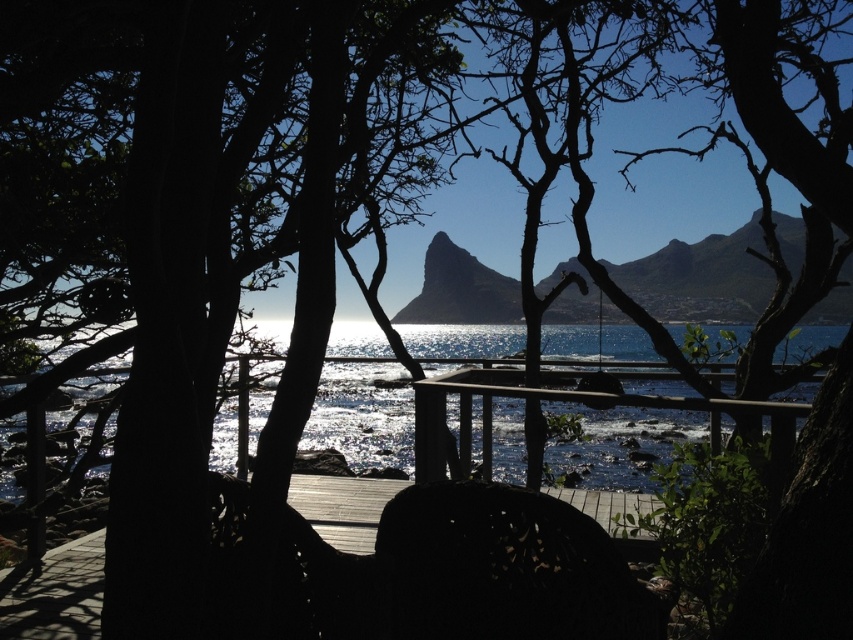
Question: Which point is closer to the camera taking this photo?

Choices:
 (A) (500, 496)
 (B) (646, 556)
 (C) (341, 420)

Answer: (A)

Question: Considering the real-world distances, which object is closest to the black matte chair at center?

Choices:
 (A) translucent glass water at center
 (B) dark wood deck at center

Answer: (B)

Question: Is black matte chair at center further to the viewer compared to dark wood deck at center?

Choices:
 (A) yes
 (B) no

Answer: (B)

Question: Does translucent glass water at center have a smaller size compared to dark wood deck at center?

Choices:
 (A) no
 (B) yes

Answer: (A)

Question: Which object is farther from the camera taking this photo?

Choices:
 (A) black matte chair at center
 (B) translucent glass water at center

Answer: (B)

Question: Is black matte chair at center positioned at the back of dark wood deck at center?

Choices:
 (A) no
 (B) yes

Answer: (A)